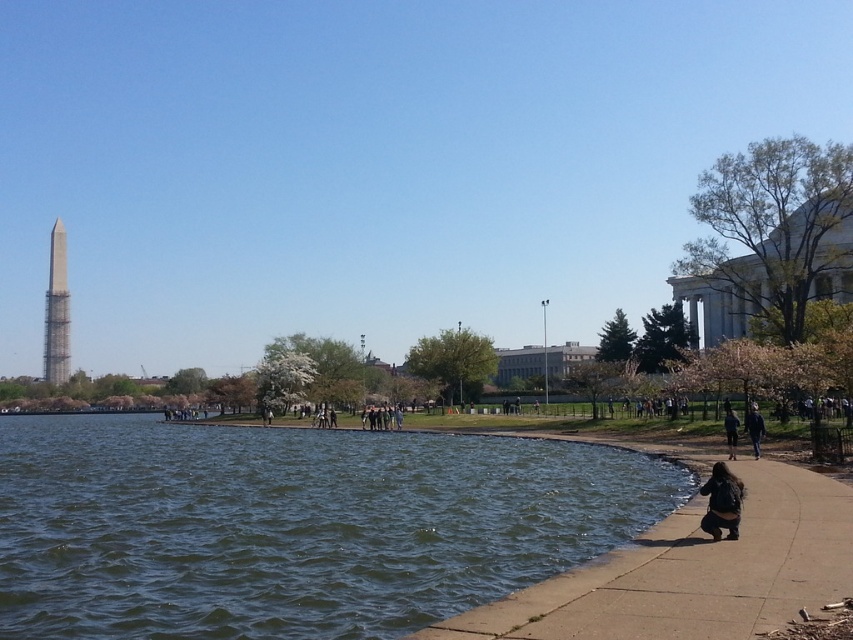
You are a photographer standing on the waterfront walkway in Washington D.C. You notice a person wearing a dark brown leather jacket at lower right and dark blue jeans at lower right. Which item is positioned closer to you?

The dark brown leather jacket at lower right is closer to the viewer than the dark blue jeans at lower right.